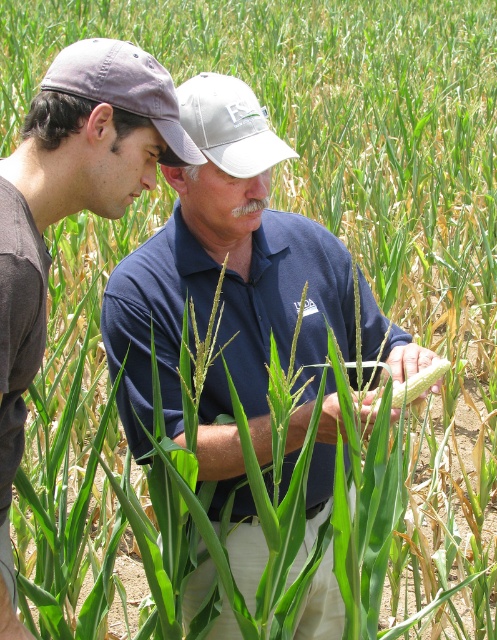
Question: Is blue cotton shirt at center above white fabric baseball cap at center?

Choices:
 (A) no
 (B) yes

Answer: (A)

Question: Does matte blue shirt at center appear on the left side of white fabric baseball cap at center?

Choices:
 (A) yes
 (B) no

Answer: (A)

Question: Which point is closer to the camera?

Choices:
 (A) (148, 124)
 (B) (262, 161)
 (C) (375, 410)

Answer: (A)

Question: Which point appears farthest from the camera in this image?

Choices:
 (A) (419, 388)
 (B) (165, 163)
 (C) (35, 369)
 (D) (210, 90)

Answer: (D)

Question: Is matte gray baseball cap at left above yellow matte corn at center?

Choices:
 (A) no
 (B) yes

Answer: (B)

Question: Considering the real-world distances, which object is farthest from the matte gray baseball cap at left?

Choices:
 (A) matte blue shirt at center
 (B) yellow matte corn at center

Answer: (B)